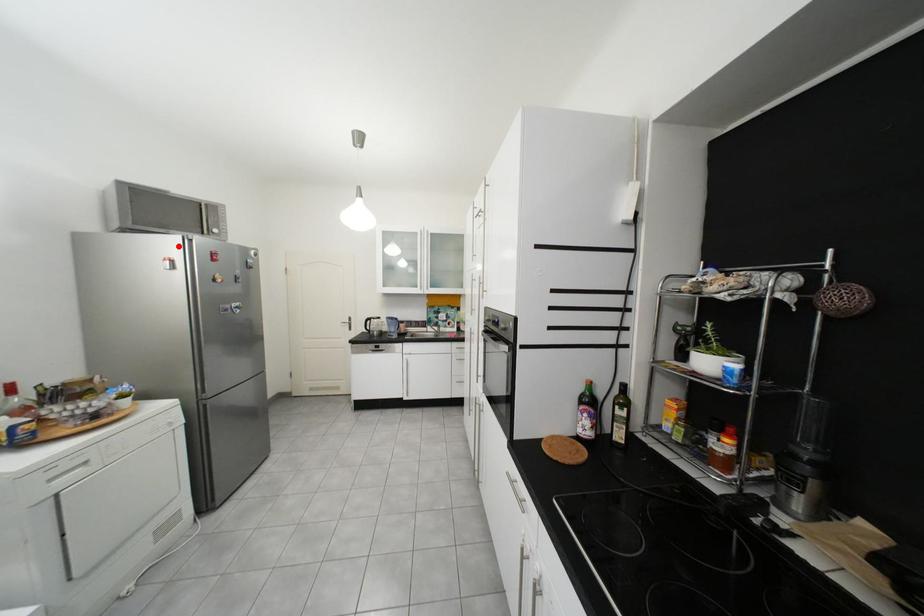
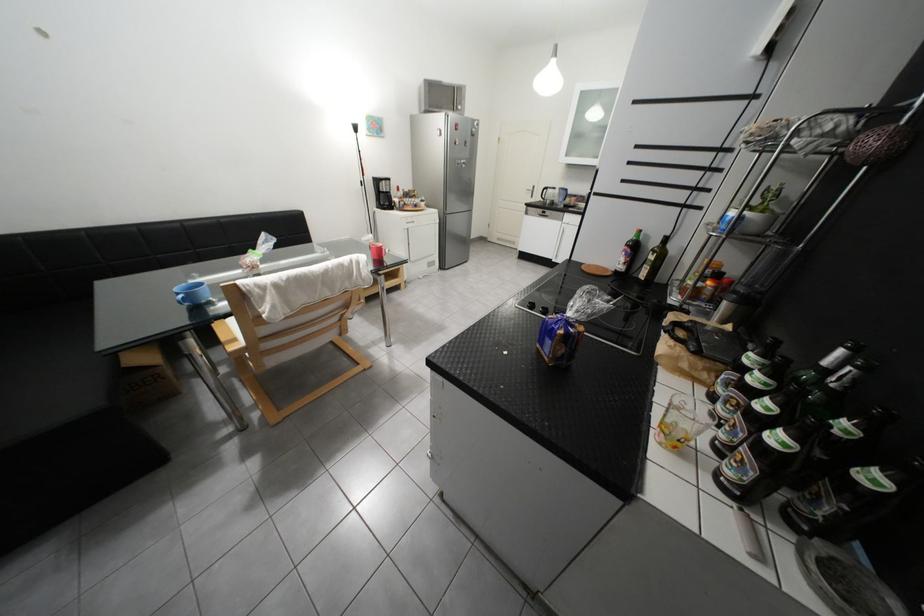
Where in the second image is the point corresponding to the highlighted location from the first image?

(451, 121)